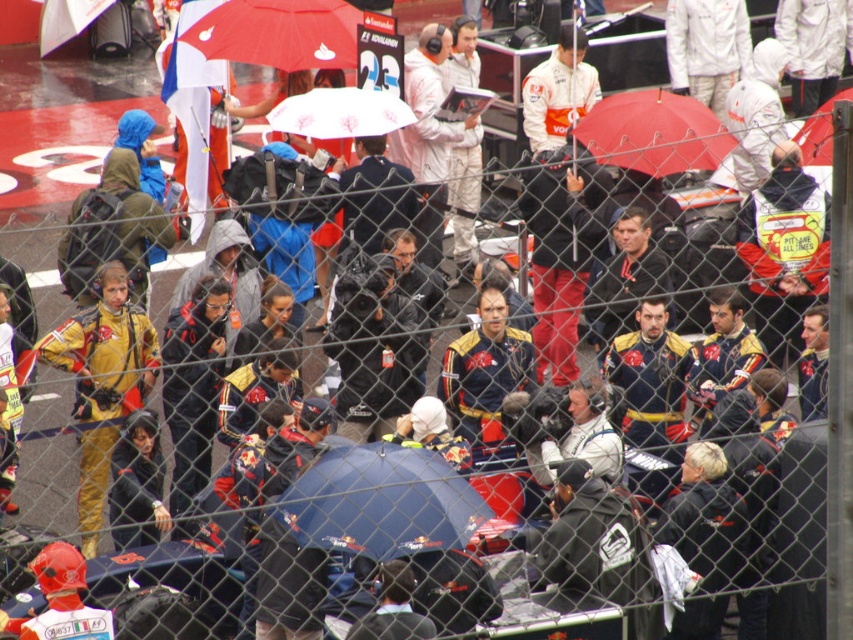
Question: Can you confirm if yellow/leather racing suit at left is positioned to the left of red matte umbrella at center?

Choices:
 (A) no
 (B) yes

Answer: (B)

Question: Based on their relative distances, which object is nearer to the red matte umbrella at center?

Choices:
 (A) black matte jacket at center
 (B) yellow/leather racing suit at left
 (C) white matte umbrella at center

Answer: (C)

Question: Estimate the real-world distances between objects in this image. Which object is closer to the matte black umbrella at upper right?

Choices:
 (A) white matte umbrella at center
 (B) black matte jacket at center
 (C) yellow/leather racing suit at left

Answer: (A)

Question: Observing the image, what is the correct spatial positioning of red matte umbrella at center in reference to matte black umbrella at upper right?

Choices:
 (A) below
 (B) above

Answer: (B)

Question: Can you confirm if yellow/leather racing suit at left is thinner than matte black umbrella at upper right?

Choices:
 (A) yes
 (B) no

Answer: (A)

Question: Which of the following is the farthest from the observer?

Choices:
 (A) (830, 131)
 (B) (138, 394)
 (C) (524, 330)

Answer: (A)